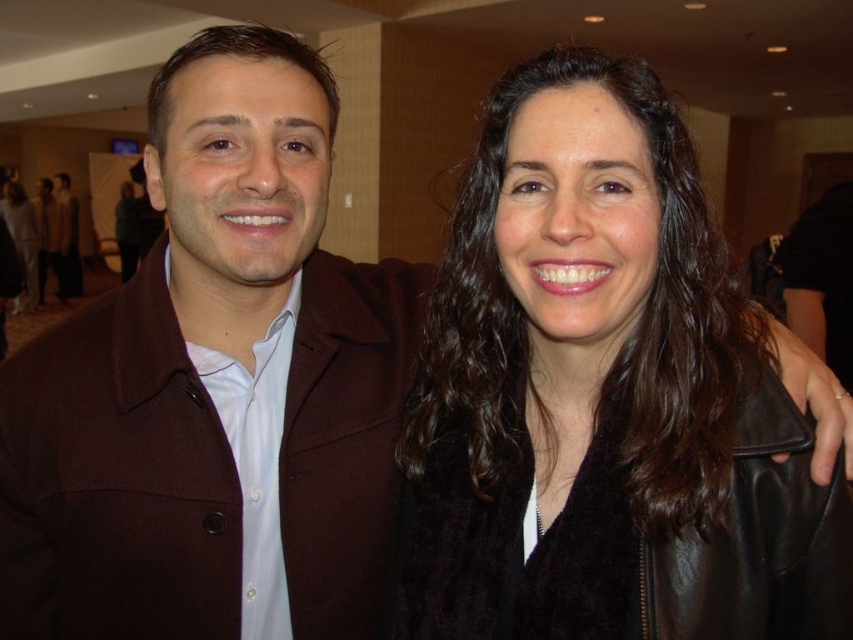
Is point (671, 278) positioned behind point (28, 260)?

No, (671, 278) is in front of (28, 260).

This screenshot has width=853, height=640. What are the coordinates of `black leather jacket at center` in the screenshot? It's located at (604, 396).

Find the location of `black leather jacket at center`. black leather jacket at center is located at coordinates (604, 396).

Is black leather jacket at center below brown woolen coat at center?

Indeed, black leather jacket at center is positioned under brown woolen coat at center.

Is black leather jacket at center smaller than brown woolen coat at center?

Yes.

You are a GUI agent. You are given a task and a screenshot of the screen. Output one action in this format:
    pyautogui.click(x=<x>, y=<y>)
    Task: Click on the black leather jacket at center
    
    Given the screenshot: What is the action you would take?
    pyautogui.click(x=604, y=396)

Who is positioned more to the right, brown woolen coat at center or matte brown coat at center?

From the viewer's perspective, brown woolen coat at center appears more on the right side.

Is brown woolen coat at center positioned before matte brown coat at center?

Yes, brown woolen coat at center is closer to the viewer.

Who is more distant from viewer, (303, 193) or (32, 198)?

The point (32, 198) is behind.

This screenshot has height=640, width=853. I want to click on brown woolen coat at center, so click(216, 388).